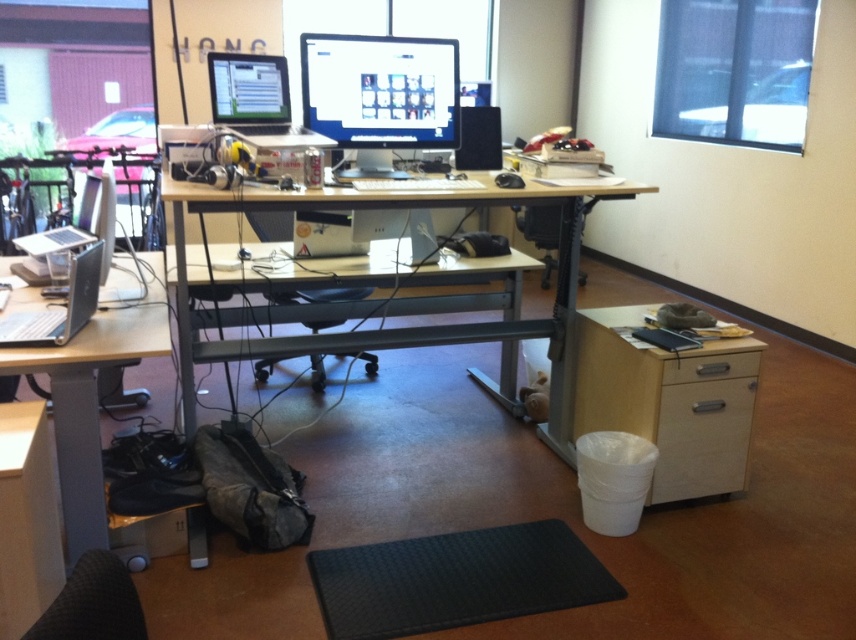
Question: Observing the image, what is the correct spatial positioning of wooden cabinet at lower right in reference to silver metallic table at left?

Choices:
 (A) right
 (B) left

Answer: (A)

Question: Is wooden cabinet at lower right thinner than black mesh office chair at center?

Choices:
 (A) no
 (B) yes

Answer: (B)

Question: Which point appears closest to the camera in this image?

Choices:
 (A) coord(183,410)
 (B) coord(316,301)

Answer: (A)

Question: Which object is the closest to the wooden cabinet at lower right?

Choices:
 (A) wooden desk at center
 (B) matte black monitor at upper center

Answer: (A)

Question: Which object is the farthest from the matte black monitor at upper center?

Choices:
 (A) black fabric swivel chair at lower left
 (B) wooden desk at center
 (C) silver metallic laptop at left
 (D) wooden cabinet at lower right

Answer: (A)

Question: Observing the image, what is the correct spatial positioning of silver metallic table at left in reference to matte black monitor at upper center?

Choices:
 (A) above
 (B) below

Answer: (B)